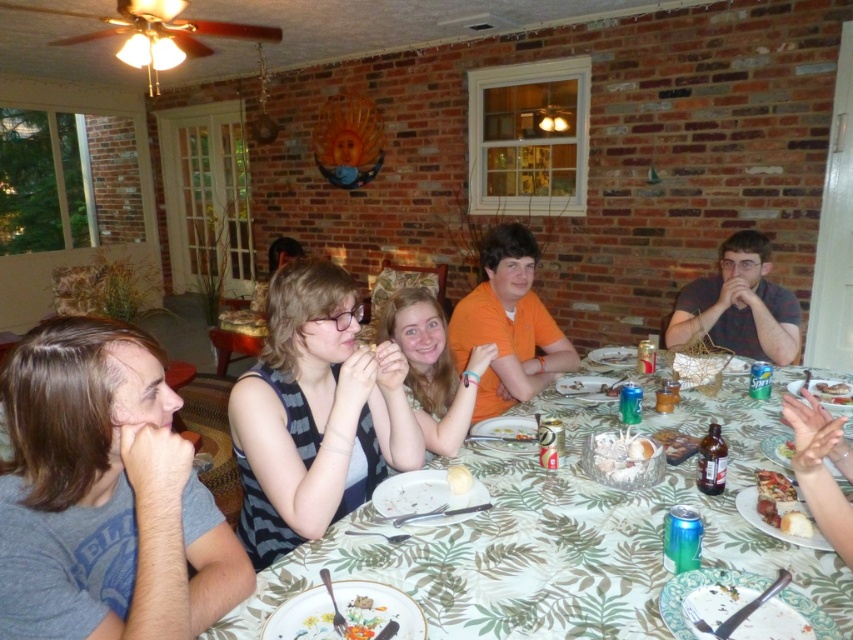
Is orange cotton shirt at center smaller than white fluffy bread at lower right?

Incorrect, orange cotton shirt at center is not smaller in size than white fluffy bread at lower right.

Between orange cotton shirt at center and white fluffy bread at lower right, which one appears on the left side from the viewer's perspective?

orange cotton shirt at center is more to the left.

The width and height of the screenshot is (853, 640). What do you see at coordinates (508, 324) in the screenshot?
I see `orange cotton shirt at center` at bounding box center [508, 324].

The image size is (853, 640). I want to click on orange cotton shirt at center, so click(508, 324).

What do you see at coordinates (433, 369) in the screenshot? This screenshot has width=853, height=640. I see `smooth orange shirt at center` at bounding box center [433, 369].

Is point (410, 360) positioned before point (776, 525)?

No.

Between point (431, 394) and point (773, 508), which one is positioned in front?

Point (773, 508) is in front.

Where is `smooth orange shirt at center`? Image resolution: width=853 pixels, height=640 pixels. smooth orange shirt at center is located at coordinates 433,369.

Can you confirm if white matte plate at lower right is thinner than white fluffy bread at lower right?

No, white matte plate at lower right is not thinner than white fluffy bread at lower right.

Which is more to the left, white matte plate at lower right or white fluffy bread at lower right?

Positioned to the left is white matte plate at lower right.

Is point (755, 506) closer to camera compared to point (790, 515)?

No, (755, 506) is behind (790, 515).

At what (x,y) coordinates should I click in order to perform the action: click on white matte plate at lower right. Please return your answer as a coordinate pair (x, y). The width and height of the screenshot is (853, 640). Looking at the image, I should click on (770, 525).